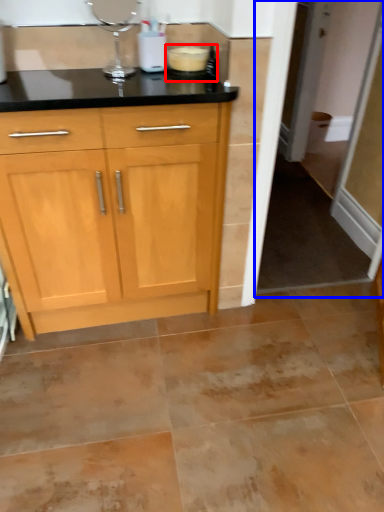
Question: Which object appears closest to the camera in this image, appliance (highlighted by a red box) or screen door (highlighted by a blue box)?

Choices:
 (A) appliance
 (B) screen door

Answer: (A)